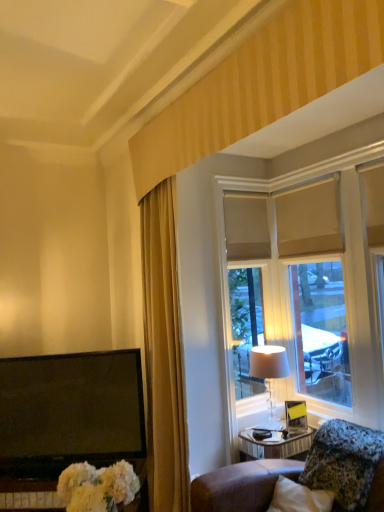
Question: From the image's perspective, is matte beige lampshade at right located above gold fabric curtain at left?

Choices:
 (A) yes
 (B) no

Answer: (B)

Question: Is matte beige lampshade at right in front of gold fabric curtain at left?

Choices:
 (A) yes
 (B) no

Answer: (B)

Question: Can you confirm if matte beige lampshade at right is positioned to the right of gold fabric curtain at left?

Choices:
 (A) no
 (B) yes

Answer: (B)

Question: Can you confirm if matte beige lampshade at right is shorter than gold fabric curtain at left?

Choices:
 (A) no
 (B) yes

Answer: (B)

Question: Considering the relative positions of matte beige lampshade at right and gold fabric curtain at left in the image provided, is matte beige lampshade at right behind gold fabric curtain at left?

Choices:
 (A) yes
 (B) no

Answer: (A)

Question: In the image, is matte beige lampshade at right positioned in front of or behind granite-like stone pillow at lower right?

Choices:
 (A) behind
 (B) front

Answer: (A)

Question: From the image's perspective, is matte beige lampshade at right located above or below granite-like stone pillow at lower right?

Choices:
 (A) below
 (B) above

Answer: (B)

Question: In terms of size, does matte beige lampshade at right appear bigger or smaller than granite-like stone pillow at lower right?

Choices:
 (A) big
 (B) small

Answer: (B)

Question: Is point (278, 352) closer or farther from the camera than point (319, 488)?

Choices:
 (A) closer
 (B) farther

Answer: (B)

Question: Is granite-like stone pillow at lower right taller or shorter than matte beige lampshade at right?

Choices:
 (A) short
 (B) tall

Answer: (A)

Question: In the image, is granite-like stone pillow at lower right positioned in front of or behind matte beige lampshade at right?

Choices:
 (A) front
 (B) behind

Answer: (A)

Question: Considering the positions of point (362, 497) and point (276, 352), is point (362, 497) closer or farther from the camera than point (276, 352)?

Choices:
 (A) closer
 (B) farther

Answer: (A)

Question: In terms of width, does granite-like stone pillow at lower right look wider or thinner when compared to matte beige lampshade at right?

Choices:
 (A) wide
 (B) thin

Answer: (A)

Question: Considering the positions of beige fabric window at upper right and granite-like stone pillow at lower right in the image, is beige fabric window at upper right wider or thinner than granite-like stone pillow at lower right?

Choices:
 (A) wide
 (B) thin

Answer: (B)

Question: Based on their sizes in the image, would you say beige fabric window at upper right is bigger or smaller than granite-like stone pillow at lower right?

Choices:
 (A) big
 (B) small

Answer: (A)